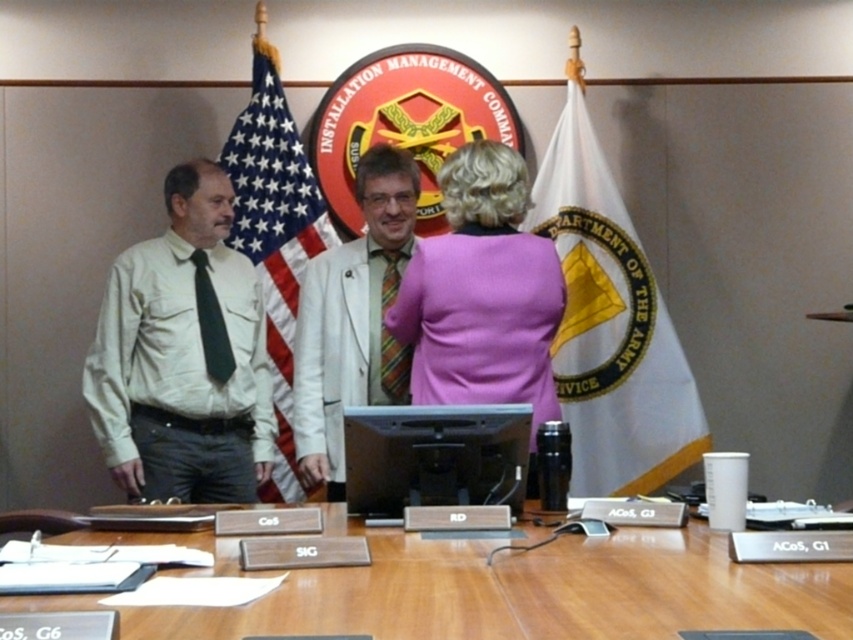
Question: Is wooden table at center positioned at the back of white textured blazer at center?

Choices:
 (A) no
 (B) yes

Answer: (A)

Question: Which object is farther from the camera taking this photo?

Choices:
 (A) black plastic monitor at center
 (B) white fabric flag at center
 (C) purple fabric coat at center

Answer: (B)

Question: Does matte khaki shirt at left have a smaller size compared to american flag at center?

Choices:
 (A) no
 (B) yes

Answer: (A)

Question: Which object is closer to the camera taking this photo?

Choices:
 (A) wooden table at center
 (B) matte khaki shirt at left

Answer: (A)

Question: Is white fabric flag at center bigger than white textured blazer at center?

Choices:
 (A) yes
 (B) no

Answer: (A)

Question: Among these points, which one is farthest from the camera?

Choices:
 (A) (271, 44)
 (B) (370, 467)
 (C) (602, 573)

Answer: (A)